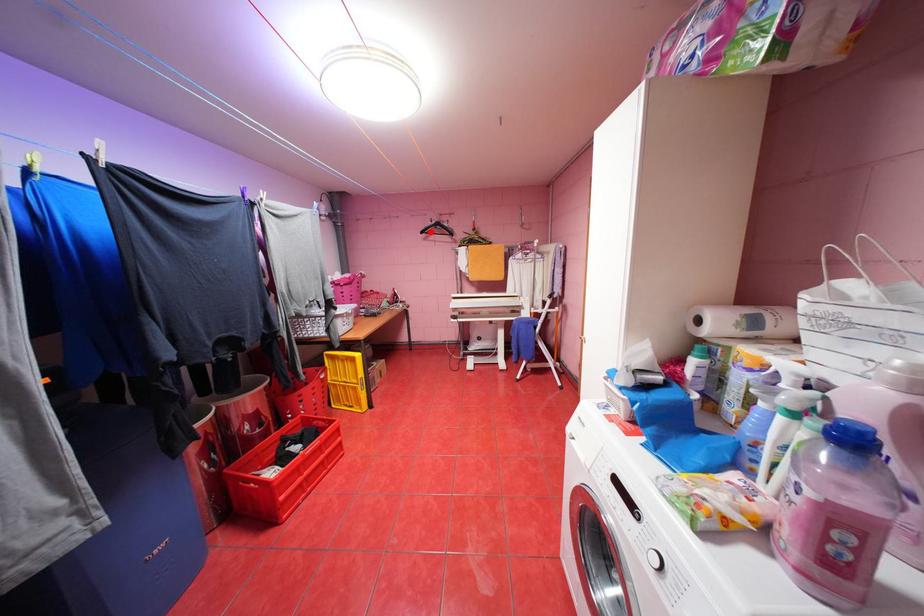
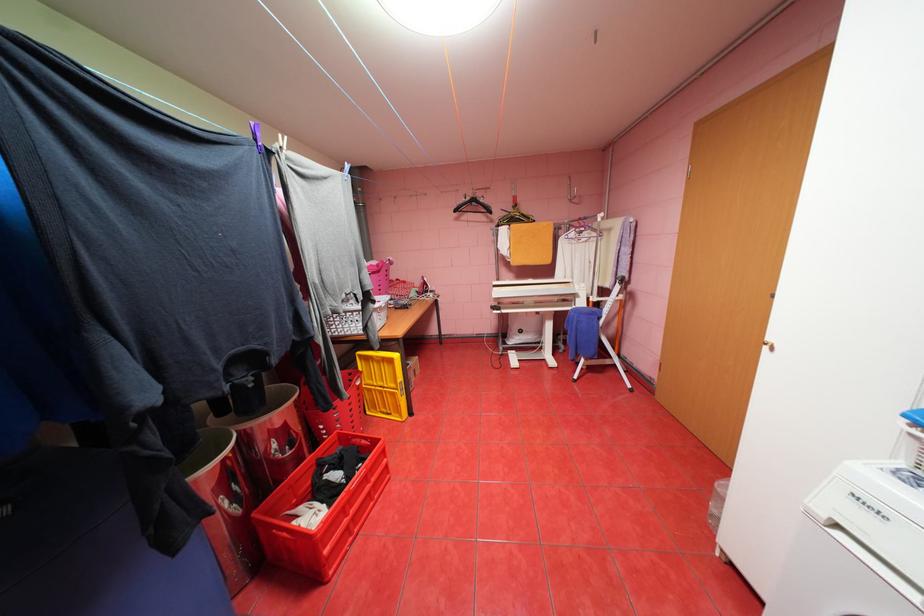
Locate, in the second image, the point that corresponds to the highlighted location in the first image.

(464, 209)